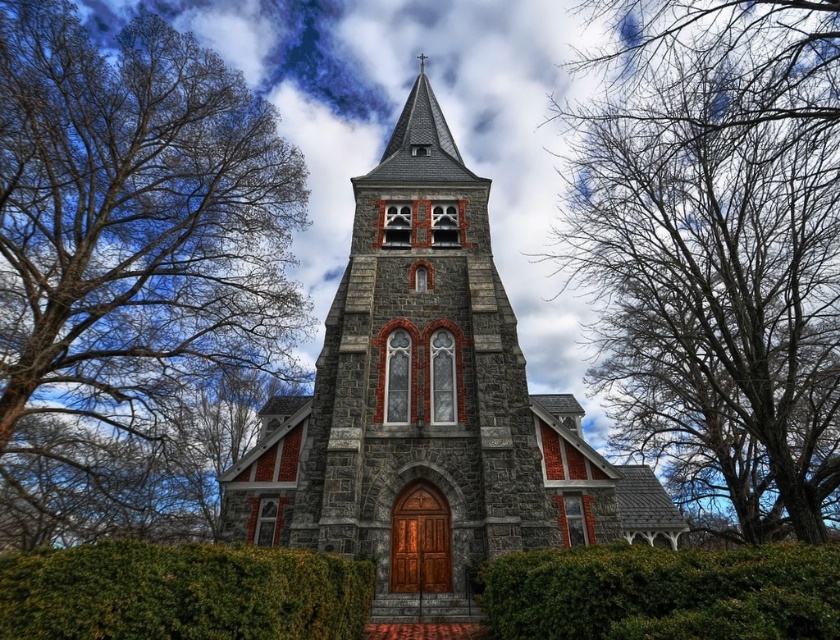
Which is below, bare branches at left or gray stone church at center?

bare branches at left is below.

In the scene shown: Can you confirm if bare branches at left is shorter than gray stone church at center?

Yes, bare branches at left is shorter than gray stone church at center.

Image resolution: width=840 pixels, height=640 pixels. Describe the element at coordinates (126, 257) in the screenshot. I see `bare branches at left` at that location.

Identify the location of bare branches at left. (126, 257).

Does gray stone church at center lie behind bare branches at upper left?

That is False.

Which is behind, point (489, 468) or point (791, 502)?

The point (791, 502) is behind.

Which is in front, point (602, 477) or point (668, 324)?

Point (602, 477) is in front.

Where is `gray stone church at center`? The width and height of the screenshot is (840, 640). gray stone church at center is located at coordinates (x=429, y=406).

Is gray stone church at center positioned before green leafy hedge at center?

No.

Who is lower down, gray stone church at center or green leafy hedge at center?

green leafy hedge at center

The width and height of the screenshot is (840, 640). What are the coordinates of `gray stone church at center` in the screenshot? It's located at (429, 406).

Where is `gray stone church at center`? The image size is (840, 640). gray stone church at center is located at coordinates (429, 406).